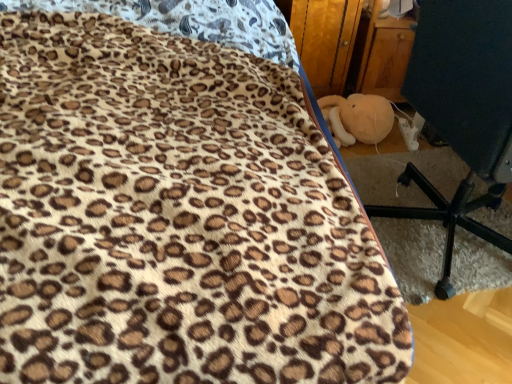
The width and height of the screenshot is (512, 384). What do you see at coordinates (357, 118) in the screenshot? I see `soft plush toy at lower right` at bounding box center [357, 118].

Image resolution: width=512 pixels, height=384 pixels. In order to click on soft plush toy at lower right in this screenshot , I will do `click(357, 118)`.

What do you see at coordinates (351, 47) in the screenshot? This screenshot has height=384, width=512. I see `wooden at right` at bounding box center [351, 47].

Identify the location of soft plush toy at lower right. (357, 118).

Between wooden at right and soft plush toy at lower right, which one has less height?

Standing shorter between the two is soft plush toy at lower right.

Between wooden at right and soft plush toy at lower right, which one has smaller size?

With smaller size is soft plush toy at lower right.

What's the angular difference between wooden at right and soft plush toy at lower right's facing directions?

wooden at right and soft plush toy at lower right are facing 100 degrees away from each other.

Can you confirm if soft plush toy at lower right is bigger than black plastic chair at lower right?

No, soft plush toy at lower right is not bigger than black plastic chair at lower right.

From the image's perspective, which one is positioned lower, soft plush toy at lower right or black plastic chair at lower right?

black plastic chair at lower right.

In terms of width, does soft plush toy at lower right look wider or thinner when compared to black plastic chair at lower right?

Considering their sizes, soft plush toy at lower right looks slimmer than black plastic chair at lower right.

Which is nearer, [352,125] or [469,219]?

Point [352,125] is farther from the camera than point [469,219].

From a real-world perspective, is black plastic chair at lower right below wooden at right?

Actually, black plastic chair at lower right is physically above wooden at right in the real world.

From the image's perspective, is black plastic chair at lower right beneath wooden at right?

Indeed, from the image's perspective, black plastic chair at lower right is shown beneath wooden at right.

Is black plastic chair at lower right far from wooden at right?

Actually, black plastic chair at lower right and wooden at right are a little close together.

Consider the image. Is black plastic chair at lower right shorter than soft plush toy at lower right?

No.

Image resolution: width=512 pixels, height=384 pixels. In order to click on toy that is above the black plastic chair at lower right (from the image's perspective) in this screenshot , I will do `click(357, 118)`.

Is soft plush toy at lower right inside black plastic chair at lower right?

No, soft plush toy at lower right is not a part of black plastic chair at lower right.

Does wooden at right turn towards black plastic chair at lower right?

Yes, wooden at right faces towards black plastic chair at lower right.

Visually, is wooden at right positioned to the left or to the right of black plastic chair at lower right?

Based on their positions, wooden at right is located to the left of black plastic chair at lower right.

Considering the positions of objects soft plush toy at lower right and wooden at right in the image provided, who is more to the right, soft plush toy at lower right or wooden at right?

From the viewer's perspective, soft plush toy at lower right appears more on the right side.

Which is behind, point (387, 126) or point (357, 35)?

The point (357, 35) is more distant.

Is soft plush toy at lower right bigger than wooden at right?

Actually, soft plush toy at lower right might be smaller than wooden at right.

Which is in front, soft plush toy at lower right or wooden at right?

wooden at right is more forward.

Where is `dresser that is in front of the soft plush toy at lower right`? dresser that is in front of the soft plush toy at lower right is located at coordinates (351, 47).

Where is `toy above the black plastic chair at lower right (from the image's perspective)`? This screenshot has width=512, height=384. toy above the black plastic chair at lower right (from the image's perspective) is located at coordinates (357, 118).

Estimate the real-world distances between objects in this image. Which object is closer to soft plush toy at lower right, wooden at right or black plastic chair at lower right?

Among the two, wooden at right is located nearer to soft plush toy at lower right.

Consider the image. From the image, which object appears to be nearer to wooden at right, soft plush toy at lower right or black plastic chair at lower right?

soft plush toy at lower right.

In the scene shown: When comparing their distances from wooden at right, does black plastic chair at lower right or soft plush toy at lower right seem further?

Among the two, black plastic chair at lower right is located further to wooden at right.

Estimate the real-world distances between objects in this image. Which object is further from soft plush toy at lower right, black plastic chair at lower right or wooden at right?

The object further to soft plush toy at lower right is black plastic chair at lower right.

From the image, which object appears to be farther from black plastic chair at lower right, soft plush toy at lower right or wooden at right?

wooden at right is further to black plastic chair at lower right.

Considering their positions, is wooden at right positioned further to black plastic chair at lower right than soft plush toy at lower right?

The object further to black plastic chair at lower right is wooden at right.

Identify the location of dresser positioned between black plastic chair at lower right and soft plush toy at lower right from near to far. The image size is (512, 384). (351, 47).